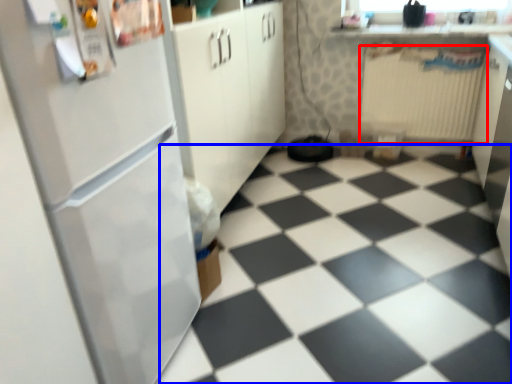
Question: Which point is further to the camera, radiator (highlighted by a red box) or tile (highlighted by a blue box)?

Choices:
 (A) radiator
 (B) tile

Answer: (A)